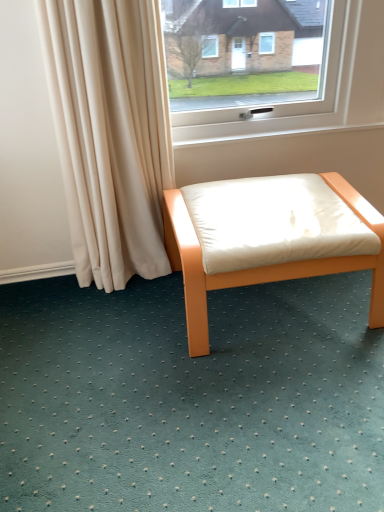
Locate an element on the screen. The height and width of the screenshot is (512, 384). vacant area to the left of matte orange stool at center is located at coordinates coord(114,333).